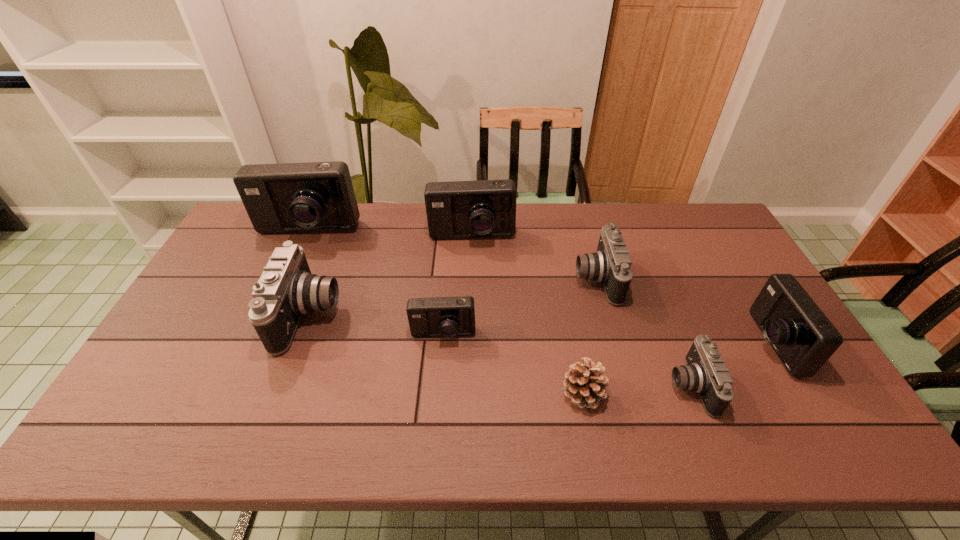
Identify the location of the tallest camera. The height and width of the screenshot is (540, 960). (316, 196).

You are a GUI agent. You are given a task and a screenshot of the screen. Output one action in this format:
    pyautogui.click(x=<x>, y=<y>)
    Task: Click on the leftmost blue camera
    The height and width of the screenshot is (540, 960).
    Given the screenshot: What is the action you would take?
    pyautogui.click(x=316, y=196)

What are the coordinates of `the third smallest blue camera` in the screenshot? It's located at (484, 208).

The width and height of the screenshot is (960, 540). In order to click on the biggest black camera in this screenshot , I will do `click(286, 290)`.

Identify the location of the rightmost camera. The height and width of the screenshot is (540, 960). (803, 338).

Locate an element on the screen. This screenshot has height=540, width=960. the rightmost object is located at coordinates (803, 338).

Locate an element on the screen. The image size is (960, 540). the third camera from right to left is located at coordinates (611, 265).

This screenshot has width=960, height=540. I want to click on the second smallest black camera, so click(611, 265).

Where is `the smallest blue camera`? The image size is (960, 540). the smallest blue camera is located at coordinates (443, 316).

The image size is (960, 540). I want to click on brown pinecone, so click(585, 386).